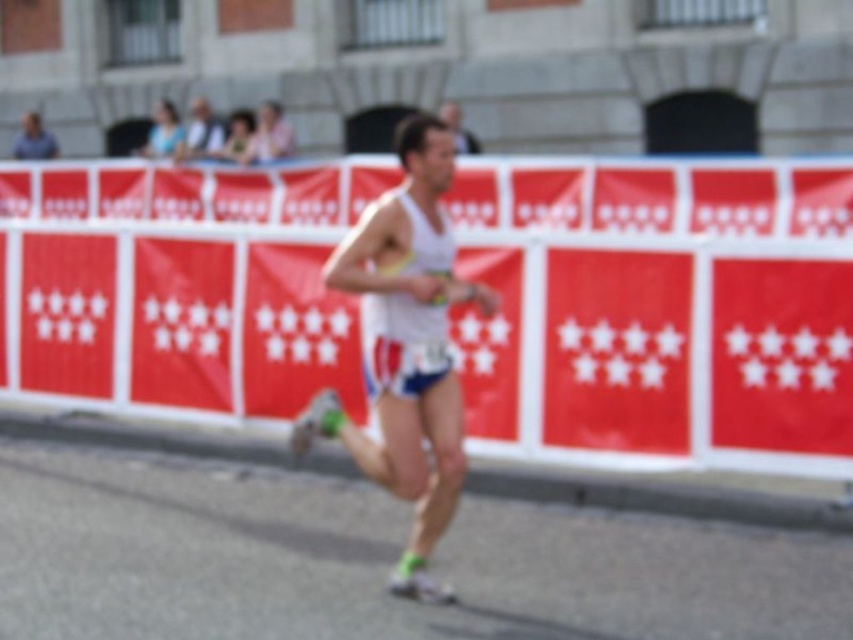
You are a photographer at the marathon event. You want to capture a photo of the white fabric runner at center and the matte blue tank top at upper left. Which object should you focus on first to ensure both are in the frame?

The white fabric runner at center is in front of the matte blue tank top at upper left, so you should focus on the white fabric runner at center first to ensure both are in the frame.